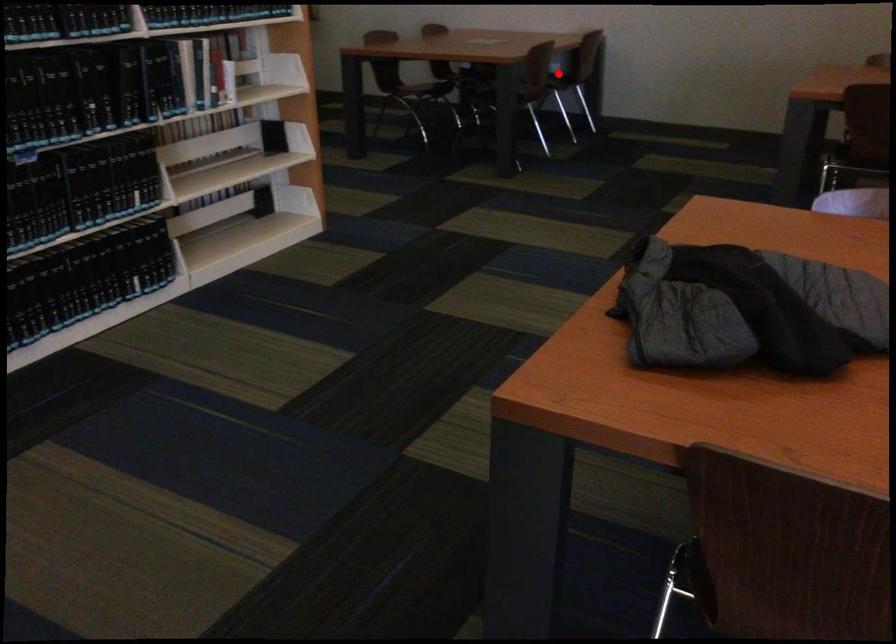
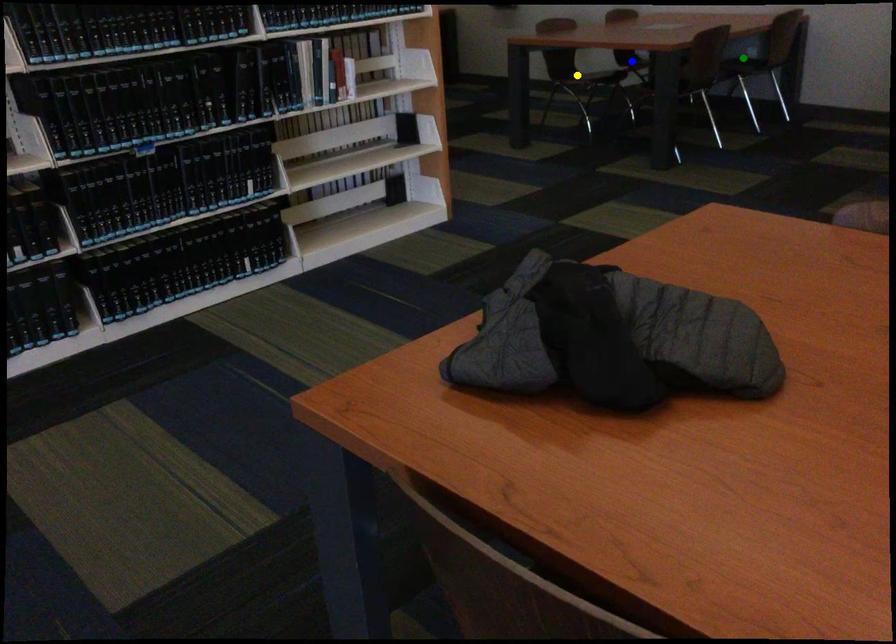
Question: I am providing you with two images of the same scene from different viewpoints. A red point is marked on the first image. You are given multiple points on the second image. Which spot in image 2 lines up with the point in image 1?

Choices:
 (A) blue point
 (B) yellow point
 (C) green point

Answer: (C)